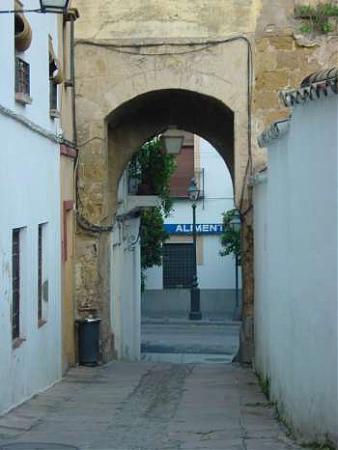
At what (x,y) coordinates should I click in order to perform the action: click on window. Please return your answer as a coordinate pair (x, y). This screenshot has height=450, width=338. Looking at the image, I should click on (44, 306).